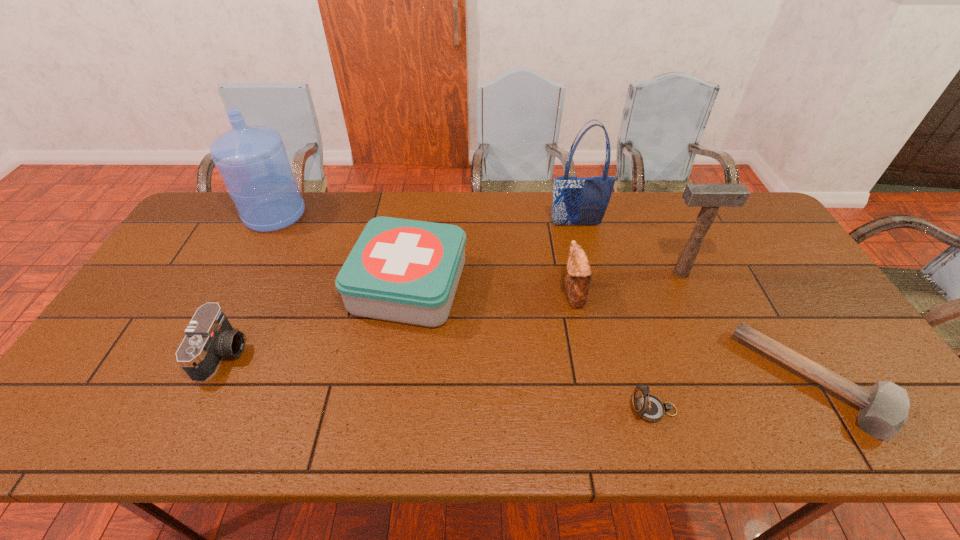
I want to click on vacant region located 0.380m on the face of the compass, so click(x=465, y=410).

In order to click on vacant space situated 0.210m on the back of the shorter mallet in this screenshot , I will do `click(750, 274)`.

Identify the location of water jug at the far edge. (252, 160).

I want to click on shopping bag that is at the far edge, so click(576, 201).

Locate an element on the screen. The height and width of the screenshot is (540, 960). compass located at the near edge is located at coordinates (648, 407).

At what (x,y) coordinates should I click in order to perform the action: click on mallet present at the near edge. Please return your answer as a coordinate pair (x, y). Looking at the image, I should click on (884, 408).

Locate an element on the screen. The width and height of the screenshot is (960, 540). object located in the left edge section of the desktop is located at coordinates click(x=252, y=160).

You are a GUI agent. You are given a task and a screenshot of the screen. Output one action in this format:
    pyautogui.click(x=<x>, y=<y>)
    Task: Click on the object positioned at the right edge
    
    Given the screenshot: What is the action you would take?
    pyautogui.click(x=884, y=408)

Image resolution: width=960 pixels, height=540 pixels. In order to click on object present at the far left corner in this screenshot , I will do tap(252, 160).

Where is `object present at the near right corner`? object present at the near right corner is located at coordinates (884, 408).